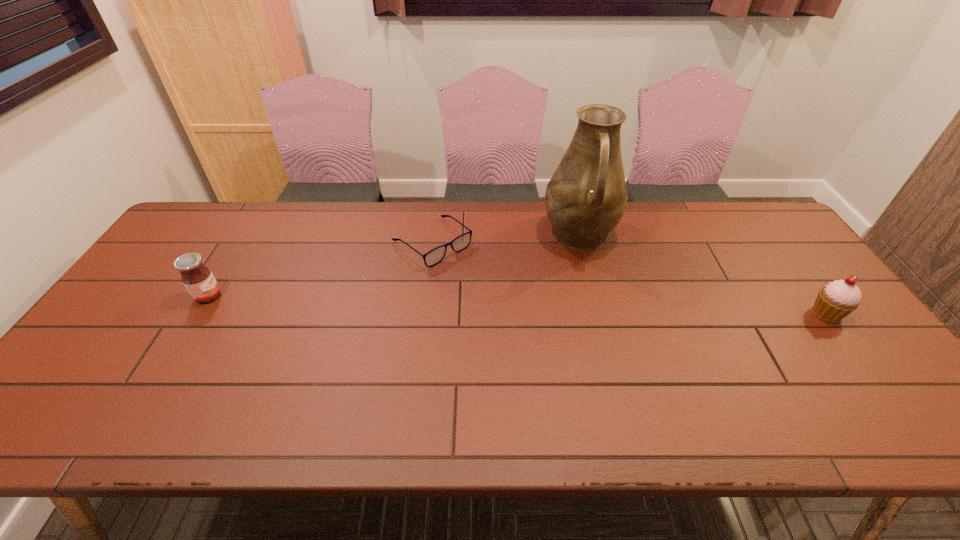
This screenshot has width=960, height=540. In order to click on jam in this screenshot , I will do `click(198, 279)`.

Locate an element on the screen. This screenshot has width=960, height=540. cupcake is located at coordinates (835, 301).

Locate an element on the screen. spectacles is located at coordinates (436, 255).

The width and height of the screenshot is (960, 540). I want to click on the third object from right to left, so click(x=436, y=255).

Image resolution: width=960 pixels, height=540 pixels. In order to click on pitcher in this screenshot , I will do `click(586, 197)`.

You are a GUI agent. You are given a task and a screenshot of the screen. Output one action in this format:
    pyautogui.click(x=<x>, y=<y>)
    Task: Click on the tallest object
    The width and height of the screenshot is (960, 540).
    Given the screenshot: What is the action you would take?
    pyautogui.click(x=586, y=197)

Locate an element on the screen. This screenshot has width=960, height=540. free space located on the label side of the leftmost object is located at coordinates (240, 296).

At what (x,y) coordinates should I click in order to perform the action: click on vacant space positioned 0.260m on the left of the cupcake. Please return your answer as a coordinate pair (x, y). The width and height of the screenshot is (960, 540). Looking at the image, I should click on (712, 313).

Where is `vacant space located 0.250m on the front-facing side of the third object from right to left`? The width and height of the screenshot is (960, 540). vacant space located 0.250m on the front-facing side of the third object from right to left is located at coordinates (516, 312).

Find the location of a particular element. blank area located 0.310m on the front-facing side of the third object from right to left is located at coordinates (532, 325).